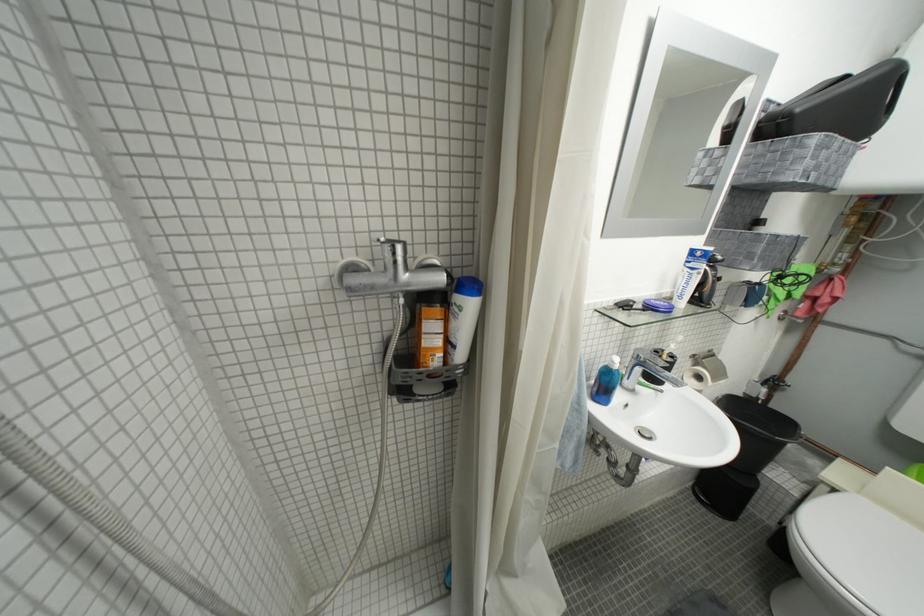
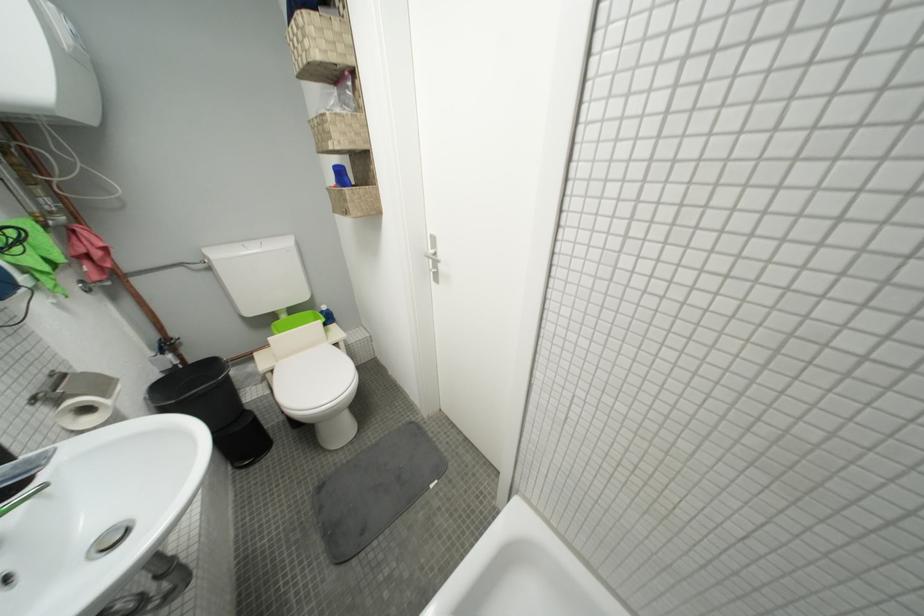
The point at (845, 493) is marked in the first image. Where is the corresponding point in the second image?

(281, 373)